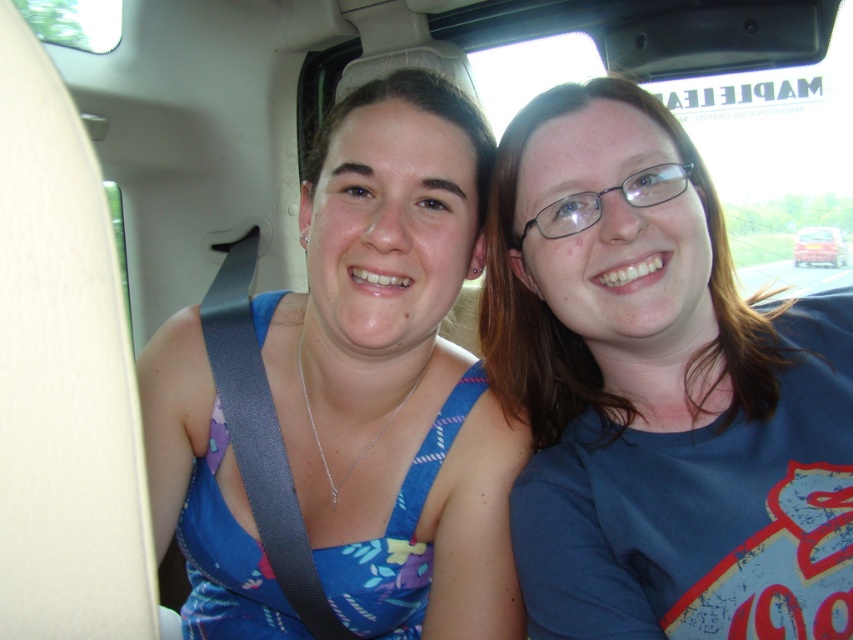
Does blue cotton shirt at center appear on the right side of blue fabric dress at center?

Yes, blue cotton shirt at center is to the right of blue fabric dress at center.

Between point (624, 566) and point (378, 632), which one is positioned in front?

Point (624, 566) is in front.

Where is `blue cotton shirt at center`? blue cotton shirt at center is located at coordinates (659, 392).

Between blue cotton shirt at center and metallic silver car at upper right, which one has more height?

Standing taller between the two is blue cotton shirt at center.

Between blue cotton shirt at center and metallic silver car at upper right, which one appears on the right side from the viewer's perspective?

metallic silver car at upper right is more to the right.

This screenshot has height=640, width=853. In order to click on blue cotton shirt at center in this screenshot , I will do `click(659, 392)`.

Find the location of a particular element. This screenshot has height=640, width=853. blue cotton shirt at center is located at coordinates (659, 392).

Can you confirm if blue fabric dress at center is taller than metallic silver car at upper right?

Yes.

Is blue fabric dress at center thinner than metallic silver car at upper right?

Indeed, blue fabric dress at center has a lesser width compared to metallic silver car at upper right.

Between point (383, 516) and point (796, 250), which one is positioned in front?

Point (383, 516) is in front.

I want to click on blue fabric dress at center, so click(x=395, y=372).